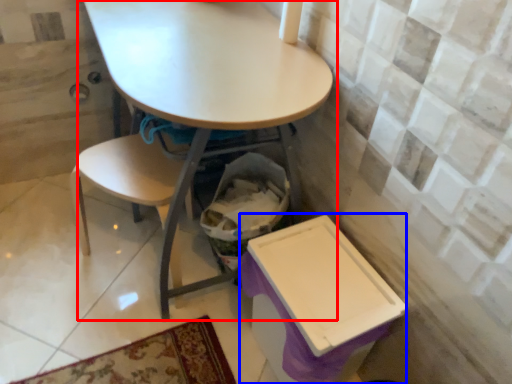
Question: Which object is further to the camera taking this photo, table (highlighted by a red box) or box (highlighted by a blue box)?

Choices:
 (A) table
 (B) box

Answer: (B)